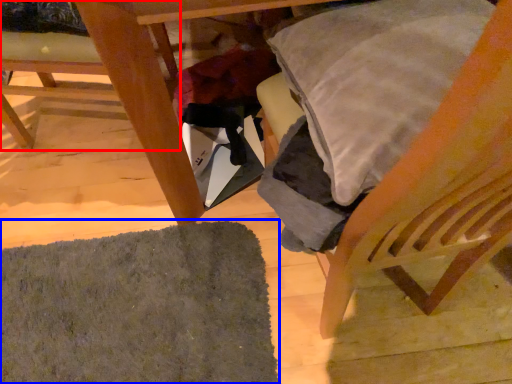
Question: Which object appears farthest to the camera in this image, chair (highlighted by a red box) or mat (highlighted by a blue box)?

Choices:
 (A) chair
 (B) mat

Answer: (B)